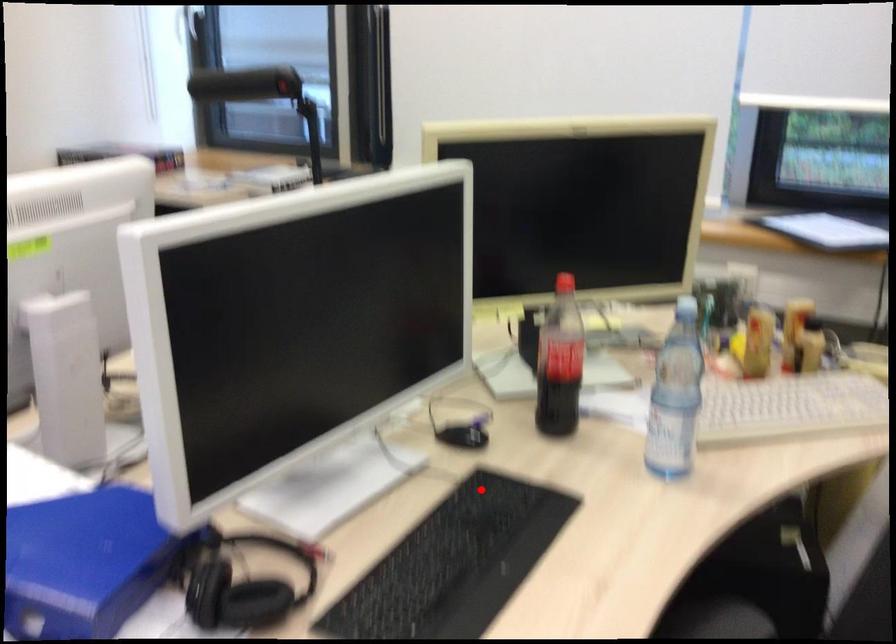
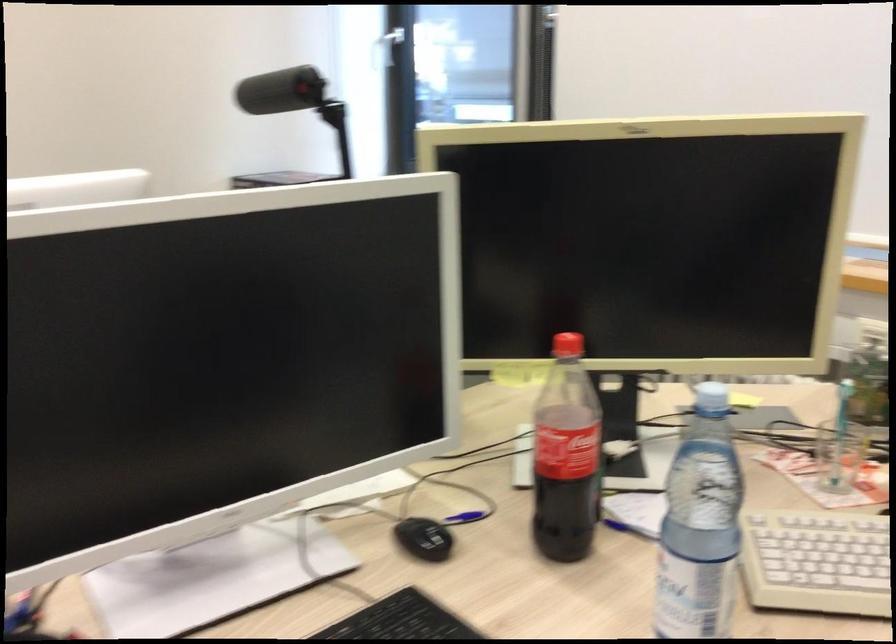
Question: I am providing you with two images of the same scene from different viewpoints. A red point is shown in image1. For the corresponding object point in image2, is it positioned nearer or farther from the camera?

Choices:
 (A) Nearer
 (B) Farther

Answer: (A)